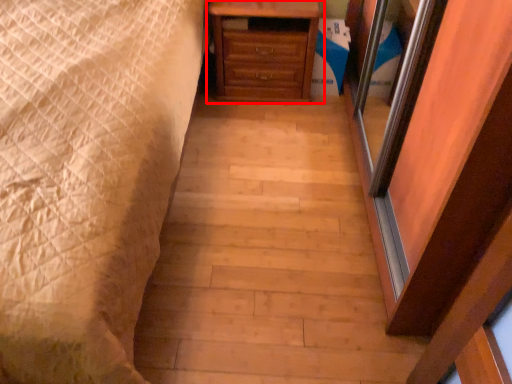
Question: Where is chest of drawers (annotated by the red box) located in relation to bed in the image?

Choices:
 (A) left
 (B) right

Answer: (B)